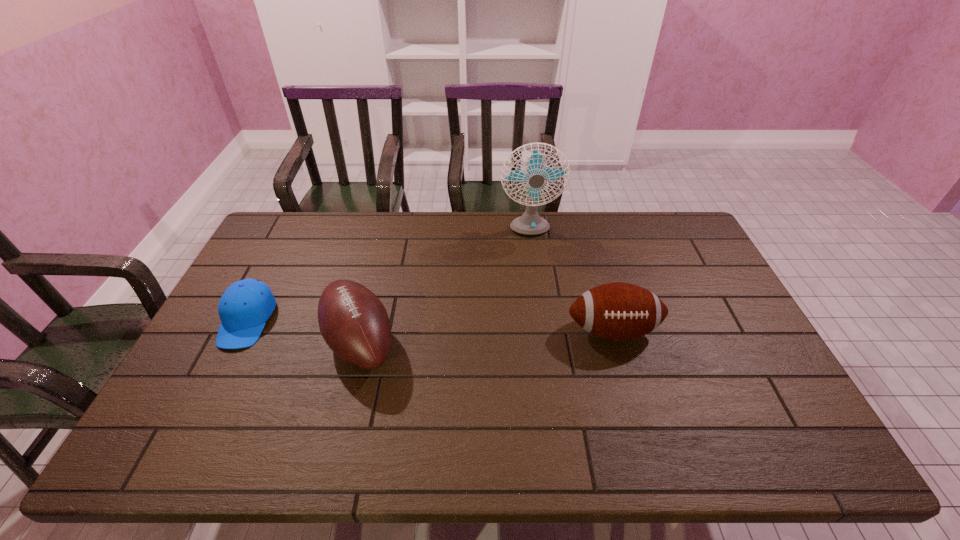
This screenshot has width=960, height=540. Find the location of `object at the far edge`. object at the far edge is located at coordinates (530, 223).

This screenshot has height=540, width=960. Find the location of `object that is positioned at the left edge`. object that is positioned at the left edge is located at coordinates (245, 306).

Identify the location of vacant area at the far edge of the desktop. (566, 230).

Locate an element on the screen. The height and width of the screenshot is (540, 960). vacant space at the near edge of the desktop is located at coordinates (656, 433).

Image resolution: width=960 pixels, height=540 pixels. I want to click on vacant space at the left edge of the desktop, so click(200, 397).

You are a GUI agent. You are given a task and a screenshot of the screen. Output one action in this format:
    pyautogui.click(x=<x>, y=<y>)
    Task: Click on the vacant space at the right edge of the desktop
    The height and width of the screenshot is (540, 960).
    Given the screenshot: What is the action you would take?
    pyautogui.click(x=711, y=360)

Find the location of `vacant space at the far left corner of the desktop`. vacant space at the far left corner of the desktop is located at coordinates (290, 247).

The width and height of the screenshot is (960, 540). What are the coordinates of `vacant position at the near right corner of the desktop` in the screenshot? It's located at (787, 443).

Find the location of a particular element. The height and width of the screenshot is (540, 960). free point between the fan and the right football is located at coordinates (570, 281).

Find the location of a particular element. blank region between the right football and the fan is located at coordinates (570, 281).